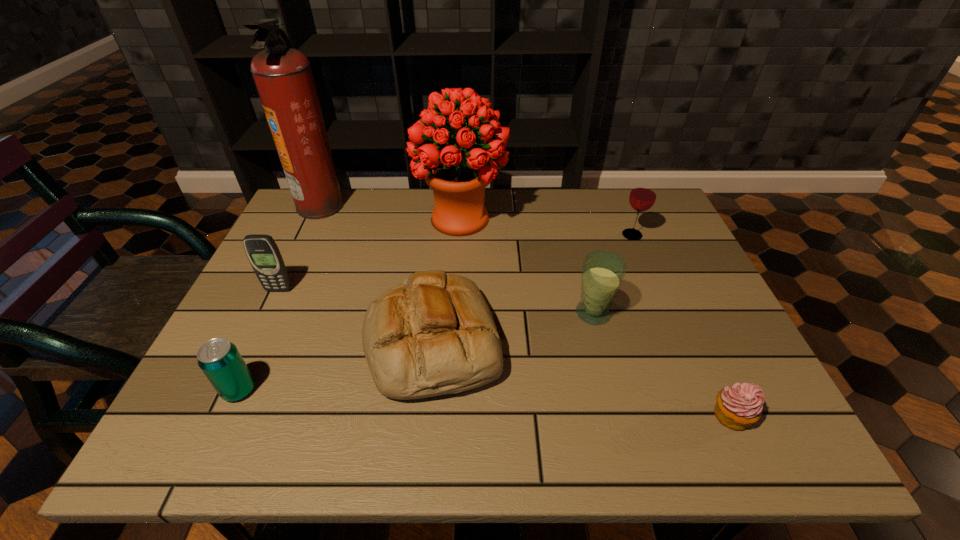
Locate an element on the screen. The image size is (960, 540). free space between the cellular telephone and the second tallest object is located at coordinates (370, 254).

Image resolution: width=960 pixels, height=540 pixels. Find the location of `free space between the beer can and the bouquet`. free space between the beer can and the bouquet is located at coordinates (349, 305).

Where is `object that is the closest to the seventh shortest object`? The height and width of the screenshot is (540, 960). object that is the closest to the seventh shortest object is located at coordinates (434, 334).

Find the location of `the second closest object to the tallest object`. the second closest object to the tallest object is located at coordinates (263, 253).

I want to click on vacant space that satisfies the following two spatial constraints: 1. at the nozzle of the fire extinguisher; 2. on the screen of the cellular telephone, so coord(281,290).

Where is `vacant region that satisfies the following two spatial constraints: 1. on the back side of the bread; 2. on the left side of the farther glass`? This screenshot has width=960, height=540. vacant region that satisfies the following two spatial constraints: 1. on the back side of the bread; 2. on the left side of the farther glass is located at coordinates (444, 235).

The width and height of the screenshot is (960, 540). What are the coordinates of `free spot that satisfies the following two spatial constraints: 1. on the back side of the second tallest object; 2. on the left side of the beer can` in the screenshot? It's located at (318, 219).

Where is `free space that satisfies the following two spatial constraints: 1. on the front side of the nearer glass; 2. on the right side of the shortest object`? The width and height of the screenshot is (960, 540). free space that satisfies the following two spatial constraints: 1. on the front side of the nearer glass; 2. on the right side of the shortest object is located at coordinates (619, 416).

I want to click on free spot that satisfies the following two spatial constraints: 1. on the front side of the left glass; 2. on the right side of the bouquet, so click(455, 313).

What are the coordinates of `vacant region that satisfies the following two spatial constraints: 1. on the screen of the cellular telephone; 2. on the left side of the cupcake` in the screenshot? It's located at (219, 416).